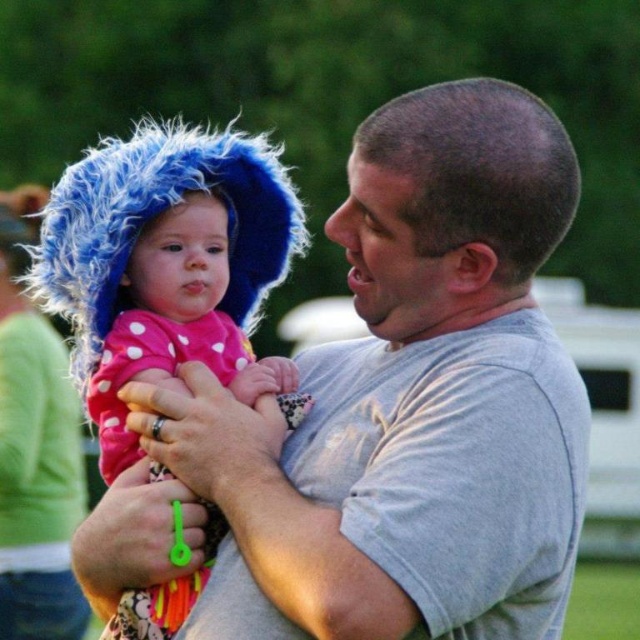
Is gray cotton shirt at center positioned before fuzzy blue hat at upper left?

Yes, gray cotton shirt at center is in front of fuzzy blue hat at upper left.

Is gray cotton shirt at center wider than fuzzy blue hat at upper left?

Indeed, gray cotton shirt at center has a greater width compared to fuzzy blue hat at upper left.

Between point (372, 499) and point (38, 547), which one is positioned in front?

Positioned in front is point (372, 499).

You are a GUI agent. You are given a task and a screenshot of the screen. Output one action in this format:
    pyautogui.click(x=<x>, y=<y>)
    Task: Click on the gray cotton shirt at center
    
    Given the screenshot: What is the action you would take?
    pyautogui.click(x=390, y=412)

Does gray cotton shirt at center appear over pink polka dot fabric at center?

Correct, gray cotton shirt at center is located above pink polka dot fabric at center.

Identify the location of gray cotton shirt at center. (390, 412).

Is point (355, 227) farther from viewer compared to point (225, 324)?

No.

Identify the location of gray cotton shirt at center. (390, 412).

Which is in front, point (138, 632) or point (76, 628)?

Point (138, 632) is more forward.

Is pink polka dot fabric at center closer to the viewer compared to fuzzy blue hat at upper left?

That is True.

Who is more forward, (224, 216) or (65, 408)?

Positioned in front is point (224, 216).

I want to click on pink polka dot fabric at center, so click(x=176, y=324).